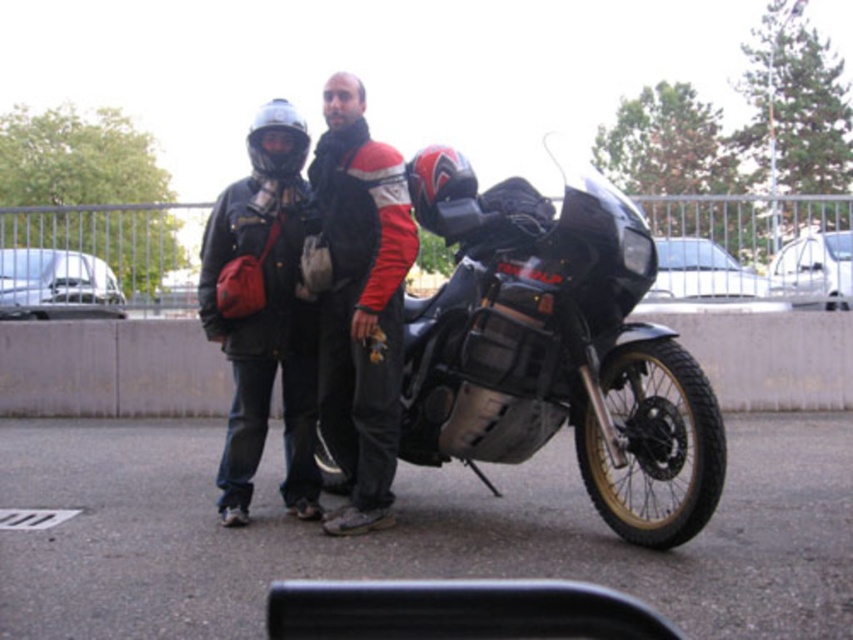
Can you confirm if black matte motorcycle at center is thinner than matte black jacket at center?

No, black matte motorcycle at center is not thinner than matte black jacket at center.

Is point (596, 289) closer to camera compared to point (294, 448)?

Yes, it is.

Which is in front, point (485, 460) or point (387, 246)?

Point (387, 246)

Image resolution: width=853 pixels, height=640 pixels. Identify the location of black matte motorcycle at center. (555, 349).